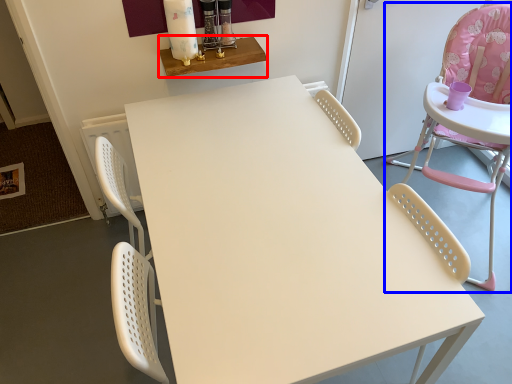
Question: Which object is further to the camera taking this photo, table (highlighted by a red box) or chair (highlighted by a blue box)?

Choices:
 (A) table
 (B) chair

Answer: (A)